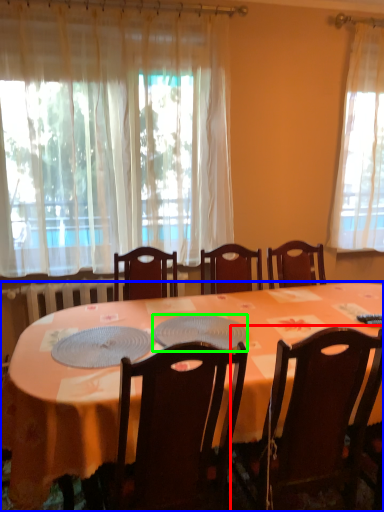
Question: Based on their relative distances, which object is farther from chair (highlighted by a red box)? Choose from desk (highlighted by a blue box) and platter (highlighted by a green box).

Choices:
 (A) desk
 (B) platter

Answer: (B)